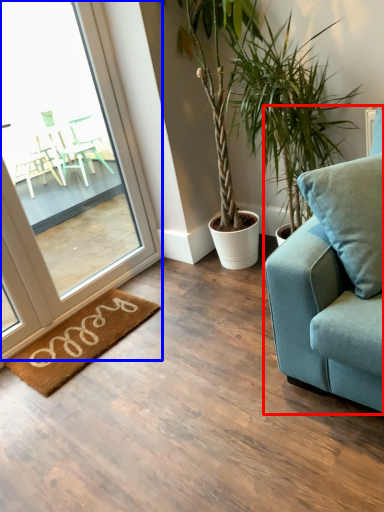
Question: Which point is further to the camera, studio couch (highlighted by a red box) or window (highlighted by a blue box)?

Choices:
 (A) studio couch
 (B) window

Answer: (B)